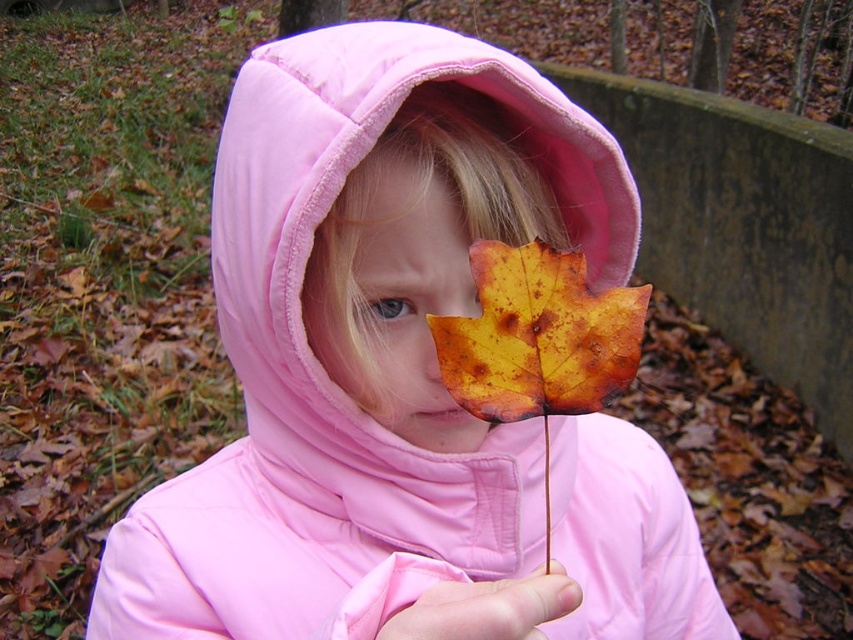
You are a photographer trying to frame a shot of the pink fleece hood at center and the yellow matte leaf at center. If you want to ensure both objects are fully visible in the frame, which object requires a wider angle due to its size?

The pink fleece hood at center requires a wider angle because its width is larger than the yellow matte leaf at center.